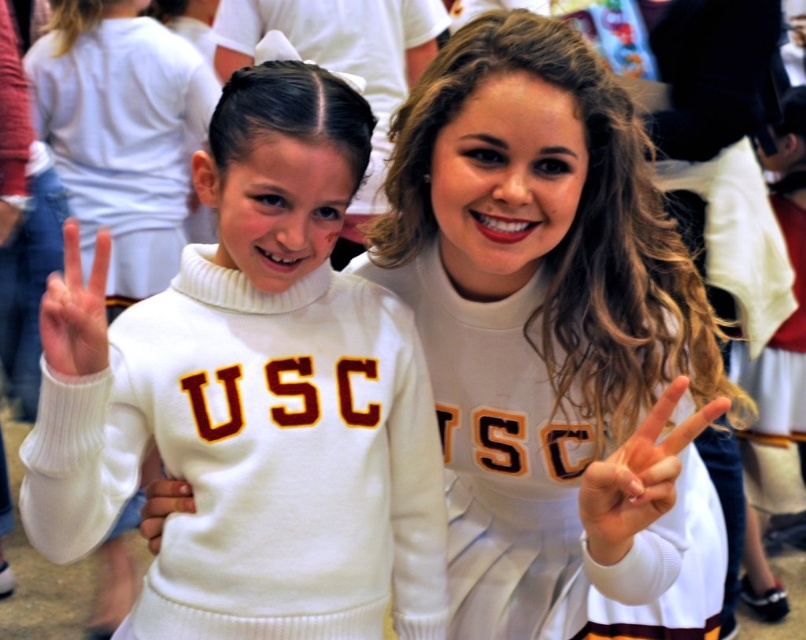
Question: Which point is farther to the camera?

Choices:
 (A) white matte hand at center
 (B) white matte hand at left
 (C) white soft hand at center
 (D) white turtleneck sweater at left

Answer: (C)

Question: Is white turtleneck sweater at left below white soft hand at center?

Choices:
 (A) no
 (B) yes

Answer: (A)

Question: Does white turtleneck sweater at left have a larger size compared to white soft hand at center?

Choices:
 (A) yes
 (B) no

Answer: (A)

Question: Does white turtleneck sweater at left have a larger size compared to white soft hand at center?

Choices:
 (A) no
 (B) yes

Answer: (B)

Question: Which point appears closest to the camera in this image?

Choices:
 (A) (148, 502)
 (B) (601, 472)
 (C) (136, 474)
 (D) (85, 291)

Answer: (B)

Question: Which object is the closest to the white matte hand at center?

Choices:
 (A) white soft hand at center
 (B) white turtleneck sweater at left
 (C) white matte hand at left

Answer: (B)